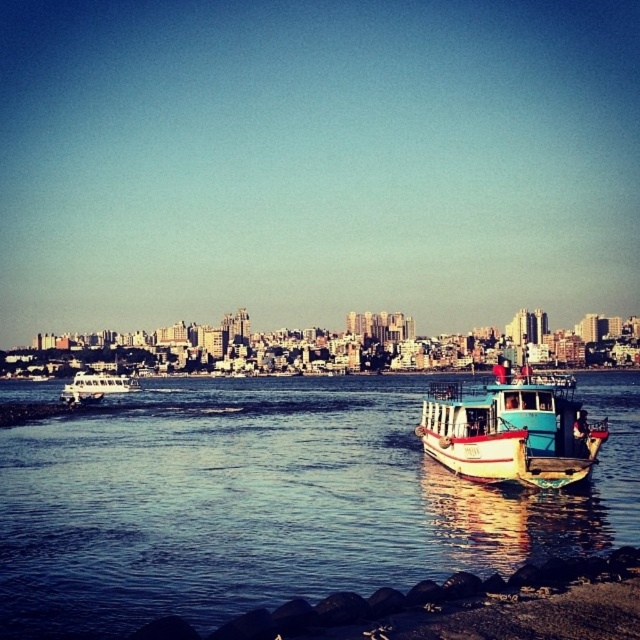
You are planning to dock a new boat at the waterfront. You have two options for docking spots. One is next to the white matte boat at lower right and the other is next to the teal wooden boat at right. Considering the width of the boats, which docking spot would require more space to accommodate your new boat?

The docking spot next to the white matte boat at lower right would require more space because the white matte boat at lower right is wider than the teal wooden boat at right.